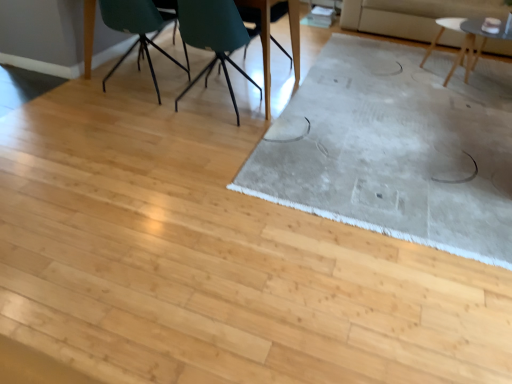
Image resolution: width=512 pixels, height=384 pixels. Find the location of `teal plastic chair at upper center, which ranks as the 2th chair in left-to-right order`. teal plastic chair at upper center, which ranks as the 2th chair in left-to-right order is located at coordinates (213, 36).

You are a GUI agent. You are given a task and a screenshot of the screen. Output one action in this format:
    pyautogui.click(x=<x>, y=<y>)
    Task: Click on the light gray textured rug at center
    This screenshot has width=512, height=384.
    Given the screenshot: What is the action you would take?
    pyautogui.click(x=396, y=149)

Locate an element on the screen. The height and width of the screenshot is (384, 512). wooden chair at center, which is the first chair in right-to-left order is located at coordinates tap(262, 28).

Image resolution: width=512 pixels, height=384 pixels. In order to click on beige fabric couch at upper right in this screenshot , I will do `click(412, 15)`.

Where is `teal plastic chair at upper center, the second chair in the right-to-left sequence`? teal plastic chair at upper center, the second chair in the right-to-left sequence is located at coordinates (213, 36).

Is matte wood table at upper center, acting as the first table starting from the left, in front of or behind white glossy table at upper right, which is the 2th table in left-to-right order, in the image?

matte wood table at upper center, acting as the first table starting from the left, is positioned closer to the viewer than white glossy table at upper right, which is the 2th table in left-to-right order.

Does point (264, 57) come in front of point (447, 77)?

Yes.

Is matte wood table at upper center, acting as the first table starting from the left, with white glossy table at upper right, arranged as the 1th table when viewed from the right?

They are not placed beside each other.

How different are the orientations of matte wood table at upper center, acting as the first table starting from the left, and white glossy table at upper right, arranged as the 1th table when viewed from the right, in degrees?

matte wood table at upper center, acting as the first table starting from the left, and white glossy table at upper right, arranged as the 1th table when viewed from the right, are facing 176 degrees away from each other.

Which is more to the left, teal plastic chair at upper center, which ranks as the 2th chair in left-to-right order, or beige fabric couch at upper right?

teal plastic chair at upper center, which ranks as the 2th chair in left-to-right order.

Are teal plastic chair at upper center, which ranks as the 2th chair in left-to-right order, and beige fabric couch at upper right making contact?

No, teal plastic chair at upper center, which ranks as the 2th chair in left-to-right order, is not with beige fabric couch at upper right.

In the image, is teal plastic chair at upper center, which ranks as the 2th chair in left-to-right order, positioned in front of or behind beige fabric couch at upper right?

In the image, teal plastic chair at upper center, which ranks as the 2th chair in left-to-right order, appears in front of beige fabric couch at upper right.

Is teal plastic chair at upper center, which ranks as the 2th chair in left-to-right order, inside the boundaries of beige fabric couch at upper right, or outside?

teal plastic chair at upper center, which ranks as the 2th chair in left-to-right order, is spatially situated outside beige fabric couch at upper right.

Does point (182, 92) come farther from viewer compared to point (111, 15)?

Yes, it is.

Does teal plastic chair at upper center, the second chair in the right-to-left sequence, come in front of matte teal chair at upper left, which ranks as the first chair in left-to-right order?

Yes, it is.

Does teal plastic chair at upper center, which ranks as the 2th chair in left-to-right order, have a greater height compared to matte teal chair at upper left, positioned as the 3th chair in right-to-left order?

Indeed, teal plastic chair at upper center, which ranks as the 2th chair in left-to-right order, has a greater height compared to matte teal chair at upper left, positioned as the 3th chair in right-to-left order.

From a real-world perspective, is teal plastic chair at upper center, the second chair in the right-to-left sequence, physically below matte teal chair at upper left, which ranks as the first chair in left-to-right order?

Incorrect, from a real-world perspective, teal plastic chair at upper center, the second chair in the right-to-left sequence, is higher than matte teal chair at upper left, which ranks as the first chair in left-to-right order.

From the image's perspective, is wooden chair at center, which is the first chair in right-to-left order, located above or below teal plastic chair at upper center, which ranks as the 2th chair in left-to-right order?

wooden chair at center, which is the first chair in right-to-left order, is above teal plastic chair at upper center, which ranks as the 2th chair in left-to-right order.

Considering the relative sizes of wooden chair at center, positioned as the third chair in left-to-right order, and teal plastic chair at upper center, which ranks as the 2th chair in left-to-right order, in the image provided, is wooden chair at center, positioned as the third chair in left-to-right order, taller than teal plastic chair at upper center, which ranks as the 2th chair in left-to-right order,?

No, wooden chair at center, positioned as the third chair in left-to-right order, is not taller than teal plastic chair at upper center, which ranks as the 2th chair in left-to-right order.

Is wooden chair at center, positioned as the third chair in left-to-right order, bigger than teal plastic chair at upper center, the second chair in the right-to-left sequence?

No.

Measure the distance from wooden chair at center, positioned as the third chair in left-to-right order, to teal plastic chair at upper center, which ranks as the 2th chair in left-to-right order.

A distance of 34.42 inches exists between wooden chair at center, positioned as the third chair in left-to-right order, and teal plastic chair at upper center, which ranks as the 2th chair in left-to-right order.

From their relative heights in the image, would you say matte teal chair at upper left, positioned as the 3th chair in right-to-left order, is taller or shorter than light gray textured rug at center?

matte teal chair at upper left, positioned as the 3th chair in right-to-left order, is taller than light gray textured rug at center.

Is matte teal chair at upper left, positioned as the 3th chair in right-to-left order, at the right side of light gray textured rug at center?

No.

From the image's perspective, between matte teal chair at upper left, positioned as the 3th chair in right-to-left order, and light gray textured rug at center, who is located below?

light gray textured rug at center, from the image's perspective.

Looking at this image, how different are the orientations of matte teal chair at upper left, which ranks as the first chair in left-to-right order, and light gray textured rug at center in degrees?

They differ by 89.8 degrees in their facing directions.

Does matte wood table at upper center, acting as the first table starting from the left, turn towards light gray textured rug at center?

No.

From the image's perspective, is matte wood table at upper center, marked as the 2th table in a right-to-left arrangement, below light gray textured rug at center?

No.

Looking at this image, is matte wood table at upper center, marked as the 2th table in a right-to-left arrangement, outside of light gray textured rug at center?

Yes, matte wood table at upper center, marked as the 2th table in a right-to-left arrangement, is not within light gray textured rug at center.

Are matte wood table at upper center, acting as the first table starting from the left, and light gray textured rug at center making contact?

No, matte wood table at upper center, acting as the first table starting from the left, is not beside light gray textured rug at center.

Can you confirm if teal plastic chair at upper center, which ranks as the 2th chair in left-to-right order, is smaller than matte wood table at upper center, marked as the 2th table in a right-to-left arrangement?

Correct, teal plastic chair at upper center, which ranks as the 2th chair in left-to-right order, occupies less space than matte wood table at upper center, marked as the 2th table in a right-to-left arrangement.

Consider the image. From the image's perspective, is teal plastic chair at upper center, the second chair in the right-to-left sequence, positioned above or below matte wood table at upper center, acting as the first table starting from the left?

From the image's perspective, teal plastic chair at upper center, the second chair in the right-to-left sequence, appears below matte wood table at upper center, acting as the first table starting from the left.

Does point (236, 9) lie behind point (267, 13)?

No, it is in front of (267, 13).

The image size is (512, 384). What are the coordinates of `table lying on the left of white glossy table at upper right, arranged as the 1th table when viewed from the right` in the screenshot? It's located at (263, 44).

Locate an element on the screen. the 3rd chair directly above the beige fabric couch at upper right (from a real-world perspective) is located at coordinates (213, 36).

From the image, which object appears to be nearer to matte teal chair at upper left, which ranks as the first chair in left-to-right order, matte wood table at upper center, marked as the 2th table in a right-to-left arrangement, or light gray textured rug at center?

matte wood table at upper center, marked as the 2th table in a right-to-left arrangement, is positioned closer to the anchor matte teal chair at upper left, which ranks as the first chair in left-to-right order.

Considering their positions, is wooden chair at center, positioned as the third chair in left-to-right order, positioned further to teal plastic chair at upper center, which ranks as the 2th chair in left-to-right order, than white glossy table at upper right, arranged as the 1th table when viewed from the right?

Based on the image, white glossy table at upper right, arranged as the 1th table when viewed from the right, appears to be further to teal plastic chair at upper center, which ranks as the 2th chair in left-to-right order.

Estimate the real-world distances between objects in this image. Which object is closer to white glossy table at upper right, arranged as the 1th table when viewed from the right, matte teal chair at upper left, which ranks as the first chair in left-to-right order, or light gray textured rug at center?

Based on the image, light gray textured rug at center appears to be nearer to white glossy table at upper right, arranged as the 1th table when viewed from the right.

Estimate the real-world distances between objects in this image. Which object is further from light gray textured rug at center, white glossy table at upper right, which is the 2th table in left-to-right order, or teal plastic chair at upper center, the second chair in the right-to-left sequence?

teal plastic chair at upper center, the second chair in the right-to-left sequence, lies further to light gray textured rug at center than the other object.

Considering their positions, is light gray textured rug at center positioned further to matte wood table at upper center, acting as the first table starting from the left, than beige fabric couch at upper right?

beige fabric couch at upper right.

Which object lies further to the anchor point white glossy table at upper right, arranged as the 1th table when viewed from the right, matte wood table at upper center, marked as the 2th table in a right-to-left arrangement, or matte teal chair at upper left, positioned as the 3th chair in right-to-left order?

Based on the image, matte teal chair at upper left, positioned as the 3th chair in right-to-left order, appears to be further to white glossy table at upper right, arranged as the 1th table when viewed from the right.

Based on their spatial positions, is matte teal chair at upper left, positioned as the 3th chair in right-to-left order, or white glossy table at upper right, arranged as the 1th table when viewed from the right, further from beige fabric couch at upper right?

The object further to beige fabric couch at upper right is matte teal chair at upper left, positioned as the 3th chair in right-to-left order.

From the image, which object appears to be nearer to teal plastic chair at upper center, the second chair in the right-to-left sequence, matte wood table at upper center, acting as the first table starting from the left, or white glossy table at upper right, which is the 2th table in left-to-right order?

matte wood table at upper center, acting as the first table starting from the left.

Image resolution: width=512 pixels, height=384 pixels. I want to click on table between matte teal chair at upper left, positioned as the 3th chair in right-to-left order, and white glossy table at upper right, which is the 2th table in left-to-right order, in the horizontal direction, so click(263, 44).

At what (x,y) coordinates should I click in order to perform the action: click on chair between teal plastic chair at upper center, which ranks as the 2th chair in left-to-right order, and beige fabric couch at upper right from left to right. Please return your answer as a coordinate pair (x, y). Looking at the image, I should click on (262, 28).

You are a GUI agent. You are given a task and a screenshot of the screen. Output one action in this format:
    pyautogui.click(x=<x>, y=<y>)
    Task: Click on the table between matte wood table at upper center, acting as the first table starting from the left, and beige fabric couch at upper right
    This screenshot has width=512, height=384.
    Given the screenshot: What is the action you would take?
    pyautogui.click(x=465, y=41)

The width and height of the screenshot is (512, 384). Identify the location of mat between matte wood table at upper center, acting as the first table starting from the left, and white glossy table at upper right, which is the 2th table in left-to-right order, in the horizontal direction. (396, 149).